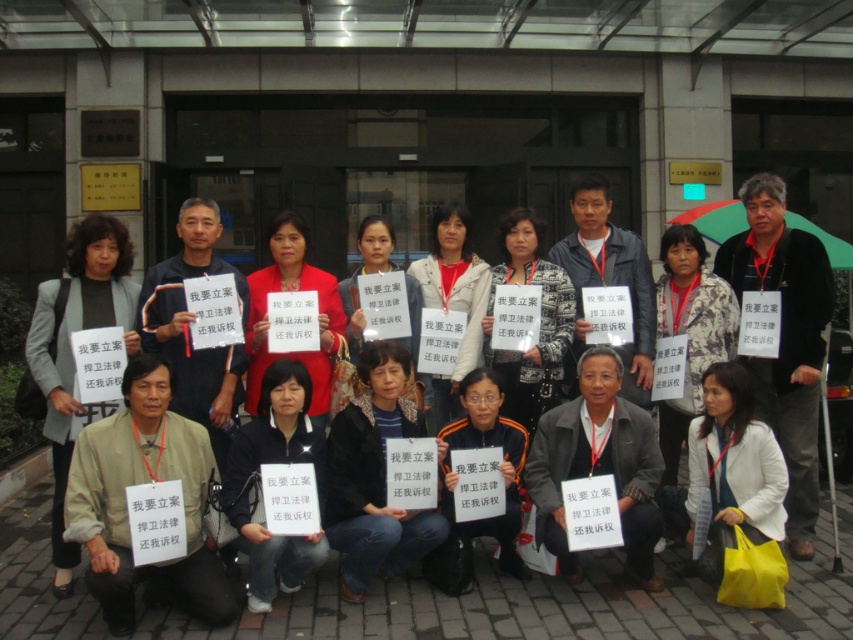
You are a photographer standing at the origin point of the coordinate system. You need to take a photo of the matte gray blazer at center. What are the coordinates where you should aim your camera?

The coordinates to aim the camera are at point 0.545 on the x axis and 0.083 on the y axis, as the matte gray blazer at center is located there.

You are a photographer trying to capture a clear shot of both the black fabric jacket at center and the matte gray blazer at center. Since you want to ensure both are visible in the frame, which clothing item should you focus on first to avoid cropping the taller one?

The black fabric jacket at center is taller than the matte gray blazer at center, so you should focus on positioning the camera to include the black fabric jacket at center first to ensure it is fully visible in the frame.

You are a photographer taking a picture of the matte gray blazer at center and the matte red coat at center. To ensure both are in frame, should you adjust your camera to the left or right? Explain your reasoning based on their positions.

The matte gray blazer at center is to the left of the matte red coat at center. To include both in the frame, you should position the camera slightly to the right so that the leftmost object, the matte gray blazer at center, remains within the frame while also capturing the matte red coat at center on the right side.